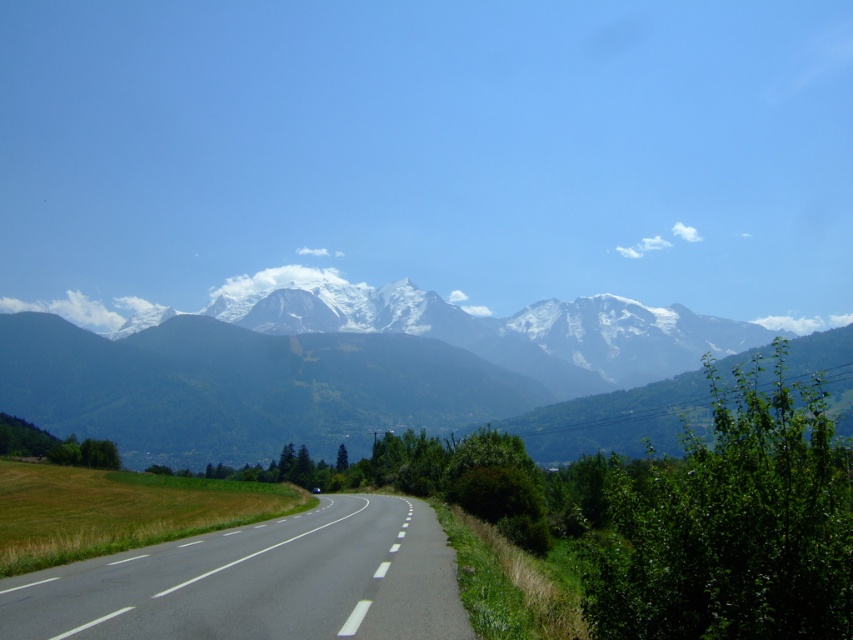
Question: Does snowy granite mountains at upper center have a greater width compared to black asphalt road at center?

Choices:
 (A) yes
 (B) no

Answer: (A)

Question: Does snowy granite mountains at upper center have a smaller size compared to black asphalt road at center?

Choices:
 (A) yes
 (B) no

Answer: (B)

Question: Which point is farther to the camera?

Choices:
 (A) (7, 593)
 (B) (138, 406)

Answer: (B)

Question: Which point is farther from the camera taking this photo?

Choices:
 (A) (189, 316)
 (B) (354, 541)

Answer: (A)

Question: Is snowy granite mountains at upper center below black asphalt road at center?

Choices:
 (A) yes
 (B) no

Answer: (A)

Question: Which point is farther to the camera?

Choices:
 (A) snowy granite mountains at upper center
 (B) black asphalt road at center

Answer: (A)